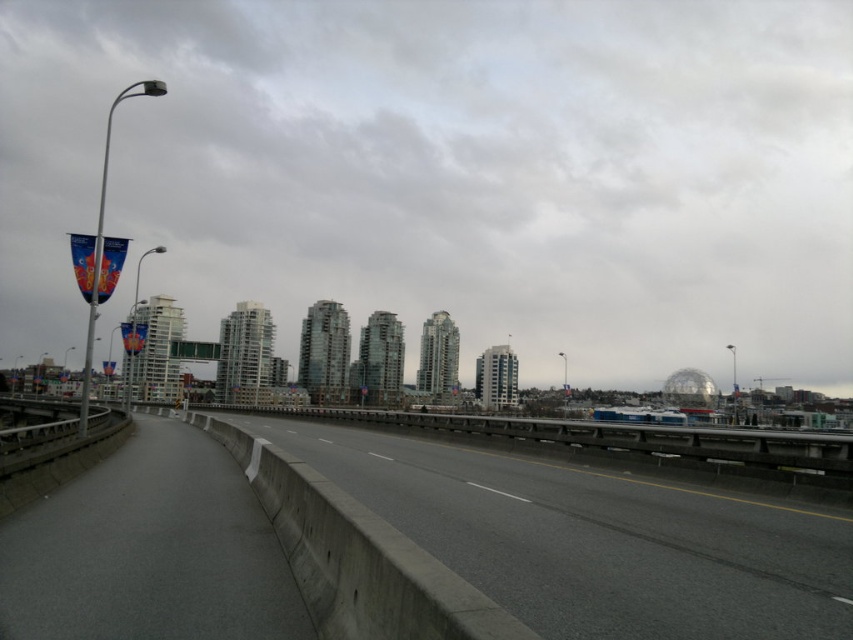
Question: Can you confirm if transparent glass buildings at center is thinner than gray concrete highway at center?

Choices:
 (A) no
 (B) yes

Answer: (A)

Question: Which object is farther from the camera taking this photo?

Choices:
 (A) transparent glass buildings at center
 (B) gray concrete highway at center

Answer: (A)

Question: Considering the relative positions of transparent glass buildings at center and gray concrete highway at center in the image provided, where is transparent glass buildings at center located with respect to gray concrete highway at center?

Choices:
 (A) below
 (B) above

Answer: (B)

Question: Is transparent glass buildings at center below gray concrete highway at center?

Choices:
 (A) yes
 (B) no

Answer: (B)